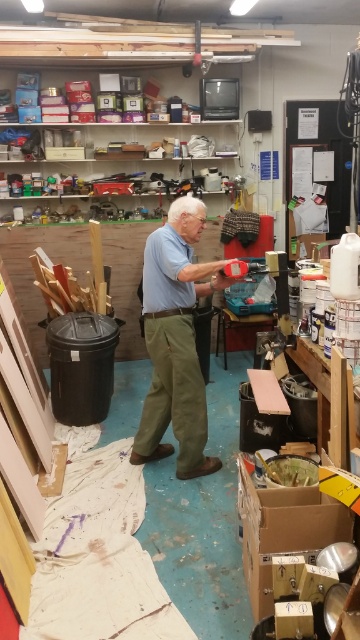
Question: Which of the following is the farthest from the observer?

Choices:
 (A) cardboard box at center
 (B) light blue cotton shirt at center

Answer: (B)

Question: Can you confirm if light blue cotton shirt at center is positioned to the right of cardboard box at center?

Choices:
 (A) yes
 (B) no

Answer: (B)

Question: Is light blue cotton shirt at center behind cardboard box at center?

Choices:
 (A) no
 (B) yes

Answer: (B)

Question: Is light blue cotton shirt at center above cardboard box at center?

Choices:
 (A) yes
 (B) no

Answer: (A)

Question: Which of the following is the closest to the observer?

Choices:
 (A) pos(173,268)
 (B) pos(312,525)

Answer: (B)